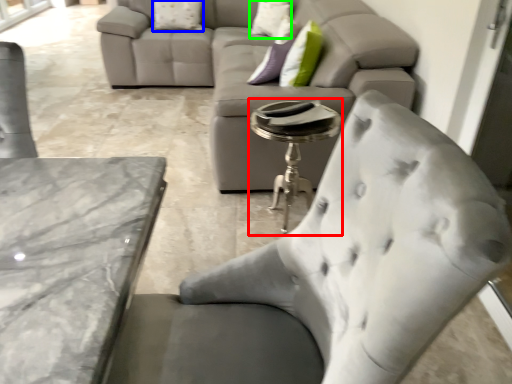
Question: Based on their relative distances, which object is nearer to side table (highlighted by a red box)? Choose from pillow (highlighted by a blue box) and pillow (highlighted by a green box).

Choices:
 (A) pillow
 (B) pillow

Answer: (B)